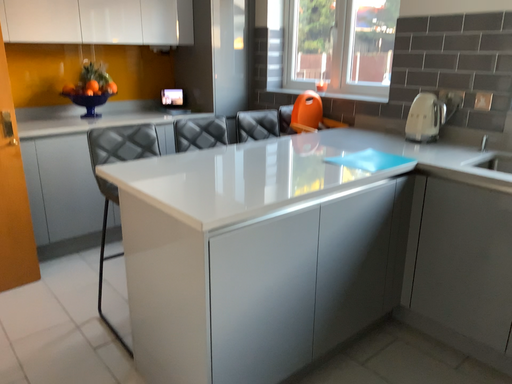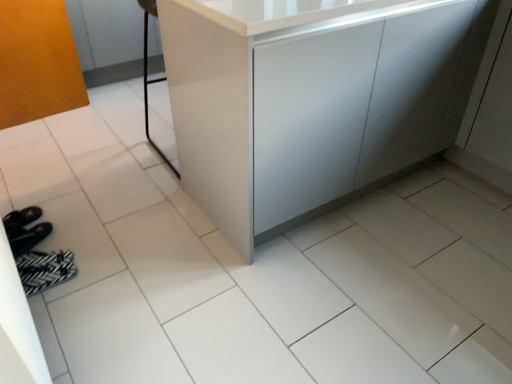
Question: Which way did the camera rotate in the video?

Choices:
 (A) rotated upward
 (B) rotated downward

Answer: (B)